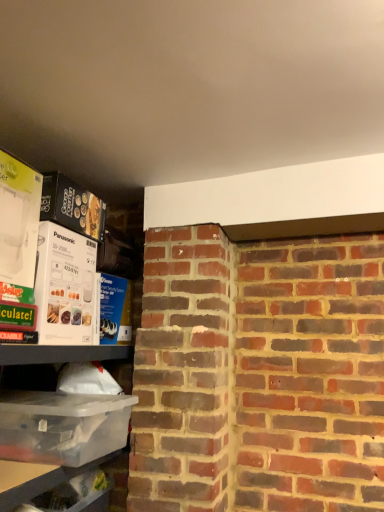
Where is `white cardboard box at left, the 2th box when ordered from bottom to top`? This screenshot has width=384, height=512. white cardboard box at left, the 2th box when ordered from bottom to top is located at coordinates (64, 286).

What do you see at coordinates (36, 478) in the screenshot? The width and height of the screenshot is (384, 512). I see `clear plastic container at lower left, placed as the first shelf when sorted from bottom to top` at bounding box center [36, 478].

How much space does clear plastic container at lower left, placed as the first shelf when sorted from bottom to top, occupy horizontally?

It is 8.66 inches.

Identify the location of transparent plastic container at lower left, arranged as the 1th box when ordered from the bottom. Image resolution: width=384 pixels, height=512 pixels. (62, 426).

The width and height of the screenshot is (384, 512). I want to click on white cardboard box at upper left, which is the 3th box from bottom to top, so click(x=18, y=220).

Image resolution: width=384 pixels, height=512 pixels. I want to click on white cardboard box at left, the 2th box when ordered from bottom to top, so click(x=64, y=286).

Is clear plastic container at lower left, arranged as the 2th shelf when viewed from the top, behind white cardboard box at upper left, which is the 3th box from bottom to top?

Yes, it is.

Is clear plastic container at lower left, placed as the first shelf when sorted from bottom to top, oriented towards white cardboard box at upper left, positioned as the first box in top-to-bottom order?

No, clear plastic container at lower left, placed as the first shelf when sorted from bottom to top, is not aimed at white cardboard box at upper left, positioned as the first box in top-to-bottom order.

Does point (34, 481) appear closer or farther from the camera than point (10, 273)?

Point (34, 481) appears to be closer to the viewer than point (10, 273).

From the image's perspective, which is above, clear plastic container at lower left, arranged as the 2th shelf when viewed from the top, or white cardboard box at upper left, positioned as the first box in top-to-bottom order?

white cardboard box at upper left, positioned as the first box in top-to-bottom order, is shown above in the image.

Considering the sizes of objects clear plastic container at left, which appears as the first shelf when viewed from the top, and white cardboard box at upper left, which is the 3th box from bottom to top, in the image provided, who is bigger, clear plastic container at left, which appears as the first shelf when viewed from the top, or white cardboard box at upper left, which is the 3th box from bottom to top,?

Bigger between the two is clear plastic container at left, which appears as the first shelf when viewed from the top.

Is clear plastic container at left, placed as the second shelf when sorted from bottom to top, far away from white cardboard box at upper left, which is the 3th box from bottom to top?

clear plastic container at left, placed as the second shelf when sorted from bottom to top, is near white cardboard box at upper left, which is the 3th box from bottom to top, not far away.

Can you confirm if clear plastic container at left, placed as the second shelf when sorted from bottom to top, is wider than white cardboard box at upper left, which is the 3th box from bottom to top?

Correct, the width of clear plastic container at left, placed as the second shelf when sorted from bottom to top, exceeds that of white cardboard box at upper left, which is the 3th box from bottom to top.

From the image's perspective, which one is positioned lower, clear plastic container at left, which appears as the first shelf when viewed from the top, or white cardboard box at upper left, which is the 3th box from bottom to top?

clear plastic container at left, which appears as the first shelf when viewed from the top.

From the image's perspective, starting from the transparent plastic container at lower left, arranged as the 1th box when ordered from the bottom, which shelf is the 1st one below? Please provide its 2D coordinates.

[(76, 457)]

From a real-world perspective, which is physically above, transparent plastic container at lower left, which ranks as the 3th box in top-to-bottom order, or clear plastic container at left, which appears as the first shelf when viewed from the top?

transparent plastic container at lower left, which ranks as the 3th box in top-to-bottom order, from a real-world perspective.

Who is taller, transparent plastic container at lower left, arranged as the 1th box when ordered from the bottom, or clear plastic container at left, which appears as the first shelf when viewed from the top?

clear plastic container at left, which appears as the first shelf when viewed from the top.

Could you measure the distance between transparent plastic container at lower left, arranged as the 1th box when ordered from the bottom, and clear plastic container at left, which appears as the first shelf when viewed from the top?

The distance of transparent plastic container at lower left, arranged as the 1th box when ordered from the bottom, from clear plastic container at left, which appears as the first shelf when viewed from the top, is 1.64 inches.

Does white cardboard box at left, acting as the second box starting from the top, contain clear plastic container at left, placed as the second shelf when sorted from bottom to top?

A: Definitely not — clear plastic container at left, placed as the second shelf when sorted from bottom to top, is not inside white cardboard box at left, acting as the second box starting from the top.

Is white cardboard box at left, acting as the second box starting from the top, placed right next to clear plastic container at left, which appears as the first shelf when viewed from the top?

They are not placed beside each other.

Does point (62, 264) come behind point (80, 448)?

Yes, point (62, 264) is behind point (80, 448).

Measure the distance between white cardboard box at left, acting as the second box starting from the top, and clear plastic container at left, which appears as the first shelf when viewed from the top.

A distance of 16.15 inches exists between white cardboard box at left, acting as the second box starting from the top, and clear plastic container at left, which appears as the first shelf when viewed from the top.

Could you tell me if clear plastic container at left, placed as the second shelf when sorted from bottom to top, is turned towards white cardboard box at left, the 2th box when ordered from bottom to top?

No, clear plastic container at left, placed as the second shelf when sorted from bottom to top, does not turn towards white cardboard box at left, the 2th box when ordered from bottom to top.

Which object is thinner, clear plastic container at left, which appears as the first shelf when viewed from the top, or white cardboard box at left, acting as the second box starting from the top?

Thinner between the two is white cardboard box at left, acting as the second box starting from the top.

Is clear plastic container at left, which appears as the first shelf when viewed from the top, taller than white cardboard box at left, acting as the second box starting from the top?

Yes, clear plastic container at left, which appears as the first shelf when viewed from the top, is taller than white cardboard box at left, acting as the second box starting from the top.

Is white cardboard box at upper left, positioned as the first box in top-to-bottom order, further to the viewer compared to clear plastic container at lower left, placed as the first shelf when sorted from bottom to top?

That is False.

Is white cardboard box at upper left, positioned as the first box in top-to-bottom order, completely or partially outside of clear plastic container at lower left, placed as the first shelf when sorted from bottom to top?

white cardboard box at upper left, positioned as the first box in top-to-bottom order, lies outside clear plastic container at lower left, placed as the first shelf when sorted from bottom to top,'s area.

What's the angular difference between white cardboard box at upper left, positioned as the first box in top-to-bottom order, and clear plastic container at lower left, arranged as the 2th shelf when viewed from the top,'s facing directions?

The facing directions of white cardboard box at upper left, positioned as the first box in top-to-bottom order, and clear plastic container at lower left, arranged as the 2th shelf when viewed from the top, are 1.62 degrees apart.

Is the surface of white cardboard box at upper left, which is the 3th box from bottom to top, in direct contact with clear plastic container at lower left, placed as the first shelf when sorted from bottom to top?

No, white cardboard box at upper left, which is the 3th box from bottom to top, is not touching clear plastic container at lower left, placed as the first shelf when sorted from bottom to top.

From a real-world perspective, between clear plastic container at lower left, arranged as the 2th shelf when viewed from the top, and transparent plastic container at lower left, which ranks as the 3th box in top-to-bottom order, who is vertically lower?

In real-world perspective, clear plastic container at lower left, arranged as the 2th shelf when viewed from the top, is lower.

Does point (30, 475) appear closer or farther from the camera than point (86, 400)?

Point (30, 475).

Is clear plastic container at lower left, arranged as the 2th shelf when viewed from the top, far from transparent plastic container at lower left, arranged as the 1th box when ordered from the bottom?

clear plastic container at lower left, arranged as the 2th shelf when viewed from the top, is near transparent plastic container at lower left, arranged as the 1th box when ordered from the bottom, not far away.

How much distance is there between clear plastic container at lower left, arranged as the 2th shelf when viewed from the top, and transparent plastic container at lower left, arranged as the 1th box when ordered from the bottom?

clear plastic container at lower left, arranged as the 2th shelf when viewed from the top, is 5.15 inches away from transparent plastic container at lower left, arranged as the 1th box when ordered from the bottom.

Starting from the clear plastic container at lower left, arranged as the 2th shelf when viewed from the top, which box is the 2nd one to the left? Please provide its 2D coordinates.

[(18, 220)]

Where is `the 1st shelf below when counting from the white cardboard box at upper left, which is the 3th box from bottom to top (from the image's perspective)`? The width and height of the screenshot is (384, 512). the 1st shelf below when counting from the white cardboard box at upper left, which is the 3th box from bottom to top (from the image's perspective) is located at coordinates (76, 457).

Which object lies nearer to the anchor point transparent plastic container at lower left, arranged as the 1th box when ordered from the bottom, white cardboard box at left, acting as the second box starting from the top, or clear plastic container at left, which appears as the first shelf when viewed from the top?

clear plastic container at left, which appears as the first shelf when viewed from the top.

When comparing their distances from transparent plastic container at lower left, arranged as the 1th box when ordered from the bottom, does white cardboard box at upper left, positioned as the first box in top-to-bottom order, or clear plastic container at lower left, arranged as the 2th shelf when viewed from the top, seem closer?

Among the two, clear plastic container at lower left, arranged as the 2th shelf when viewed from the top, is located nearer to transparent plastic container at lower left, arranged as the 1th box when ordered from the bottom.

Which object lies nearer to the anchor point white cardboard box at upper left, positioned as the first box in top-to-bottom order, clear plastic container at left, which appears as the first shelf when viewed from the top, or transparent plastic container at lower left, which ranks as the 3th box in top-to-bottom order?

Based on the image, transparent plastic container at lower left, which ranks as the 3th box in top-to-bottom order, appears to be nearer to white cardboard box at upper left, positioned as the first box in top-to-bottom order.

Estimate the real-world distances between objects in this image. Which object is closer to white cardboard box at upper left, positioned as the first box in top-to-bottom order, transparent plastic container at lower left, which ranks as the 3th box in top-to-bottom order, or white cardboard box at left, acting as the second box starting from the top?

Among the two, white cardboard box at left, acting as the second box starting from the top, is located nearer to white cardboard box at upper left, positioned as the first box in top-to-bottom order.

In the scene shown: From the image, which object appears to be nearer to transparent plastic container at lower left, which ranks as the 3th box in top-to-bottom order, clear plastic container at left, which appears as the first shelf when viewed from the top, or clear plastic container at lower left, arranged as the 2th shelf when viewed from the top?

clear plastic container at left, which appears as the first shelf when viewed from the top, lies closer to transparent plastic container at lower left, which ranks as the 3th box in top-to-bottom order, than the other object.

Looking at the image, which one is located further to clear plastic container at lower left, arranged as the 2th shelf when viewed from the top, white cardboard box at upper left, which is the 3th box from bottom to top, or white cardboard box at left, acting as the second box starting from the top?

white cardboard box at upper left, which is the 3th box from bottom to top, lies further to clear plastic container at lower left, arranged as the 2th shelf when viewed from the top, than the other object.

Which object lies further to the anchor point clear plastic container at left, placed as the second shelf when sorted from bottom to top, white cardboard box at left, the 2th box when ordered from bottom to top, or white cardboard box at upper left, which is the 3th box from bottom to top?

The object further to clear plastic container at left, placed as the second shelf when sorted from bottom to top, is white cardboard box at upper left, which is the 3th box from bottom to top.

Considering their positions, is white cardboard box at left, acting as the second box starting from the top, positioned closer to clear plastic container at lower left, arranged as the 2th shelf when viewed from the top, than white cardboard box at upper left, which is the 3th box from bottom to top?

The object closer to clear plastic container at lower left, arranged as the 2th shelf when viewed from the top, is white cardboard box at left, acting as the second box starting from the top.

The height and width of the screenshot is (512, 384). Identify the location of shelf between white cardboard box at upper left, positioned as the first box in top-to-bottom order, and clear plastic container at lower left, placed as the first shelf when sorted from bottom to top, vertically. (76, 457).

The image size is (384, 512). Find the location of `box between white cardboard box at upper left, positioned as the first box in top-to-bottom order, and transparent plastic container at lower left, which ranks as the 3th box in top-to-bottom order, vertically`. box between white cardboard box at upper left, positioned as the first box in top-to-bottom order, and transparent plastic container at lower left, which ranks as the 3th box in top-to-bottom order, vertically is located at coordinates [x=64, y=286].

In order to click on shelf between white cardboard box at left, the 2th box when ordered from bottom to top, and clear plastic container at lower left, placed as the first shelf when sorted from bottom to top, from top to bottom in this screenshot , I will do `click(76, 457)`.

Image resolution: width=384 pixels, height=512 pixels. Find the location of `box between white cardboard box at left, the 2th box when ordered from bottom to top, and clear plastic container at lower left, placed as the first shelf when sorted from bottom to top, vertically`. box between white cardboard box at left, the 2th box when ordered from bottom to top, and clear plastic container at lower left, placed as the first shelf when sorted from bottom to top, vertically is located at coordinates (62, 426).